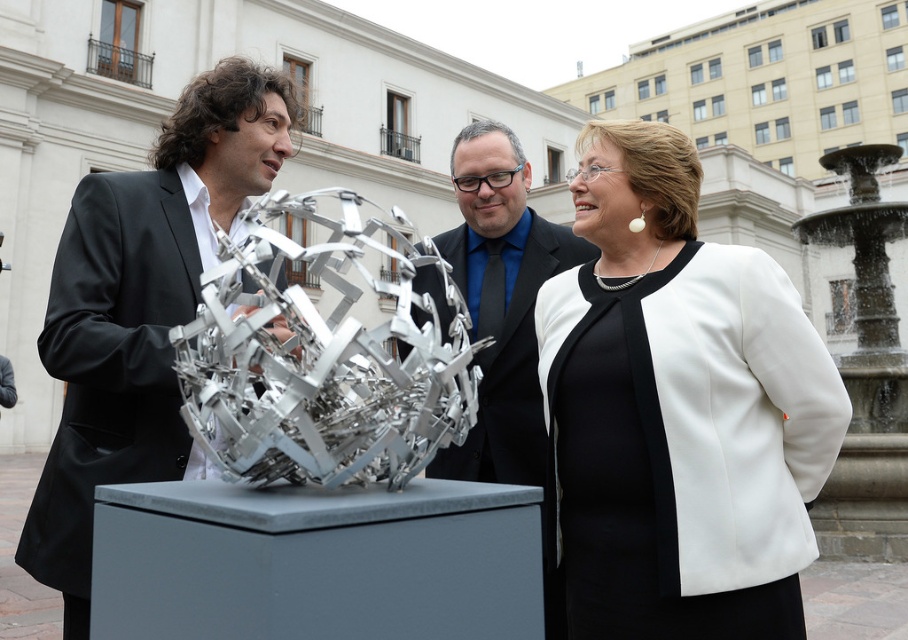
Is point (37, 552) closer to camera compared to point (491, 314)?

That is True.

Between point (213, 168) and point (510, 452), which one is positioned in front?

Point (213, 168) is more forward.

Is point (54, 486) farther from viewer compared to point (511, 253)?

No.

The width and height of the screenshot is (908, 640). What are the coordinates of `shiny silver sculpture at center` in the screenshot? It's located at (141, 308).

Can you confirm if white matte blazer at center is smaller than shiny silver sculpture at center?

Correct, white matte blazer at center occupies less space than shiny silver sculpture at center.

Is white matte blazer at center to the left of shiny silver sculpture at center from the viewer's perspective?

In fact, white matte blazer at center is to the right of shiny silver sculpture at center.

Who is more forward, (617, 630) or (169, 243)?

Point (617, 630) is in front.

You are a GUI agent. You are given a task and a screenshot of the screen. Output one action in this format:
    pyautogui.click(x=<x>, y=<y>)
    Task: Click on the white matte blazer at center
    The image size is (908, 640).
    Given the screenshot: What is the action you would take?
    pyautogui.click(x=678, y=410)

Is the position of white matte blazer at center more distant than that of shiny metallic sculpture at center?

No, white matte blazer at center is in front of shiny metallic sculpture at center.

Does white matte blazer at center have a greater height compared to shiny metallic sculpture at center?

Correct, white matte blazer at center is much taller as shiny metallic sculpture at center.

Who is more distant from viewer, (682, 497) or (492, 461)?

Positioned behind is point (492, 461).

This screenshot has width=908, height=640. In order to click on white matte blazer at center in this screenshot , I will do `click(678, 410)`.